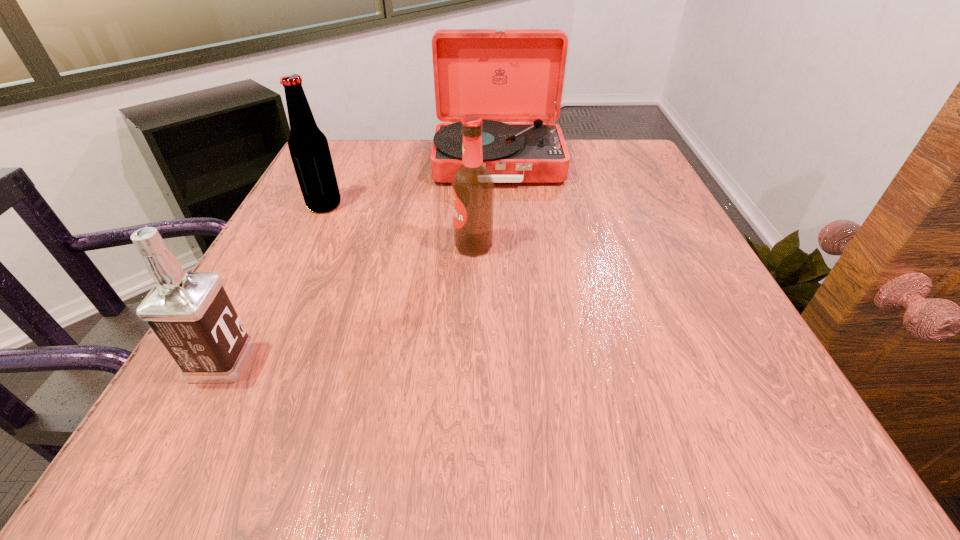
Locate which object ranks third in proximity to the farther beer bottle. Please provide its 2D coordinates. Your answer should be formatted as a tuple, i.e. [(x, y)], where the tuple contains the x and y coordinates of a point satisfying the conditions above.

[(191, 314)]

Identify the location of the closest object relative to the third nearest object. (x=501, y=75).

Find the location of `free spot that satisfies the following two spatial constraints: 1. on the front-facing side of the farthest object; 2. on the front label of the nearest object`. free spot that satisfies the following two spatial constraints: 1. on the front-facing side of the farthest object; 2. on the front label of the nearest object is located at coordinates (511, 362).

In order to click on vacant point that satisfies the following two spatial constraints: 1. on the front-facing side of the farthest object; 2. on the front label of the nearest object in this screenshot , I will do `click(511, 362)`.

The image size is (960, 540). I want to click on blank area in the image that satisfies the following two spatial constraints: 1. on the front side of the farther beer bottle; 2. on the front label of the nearest object, so click(251, 362).